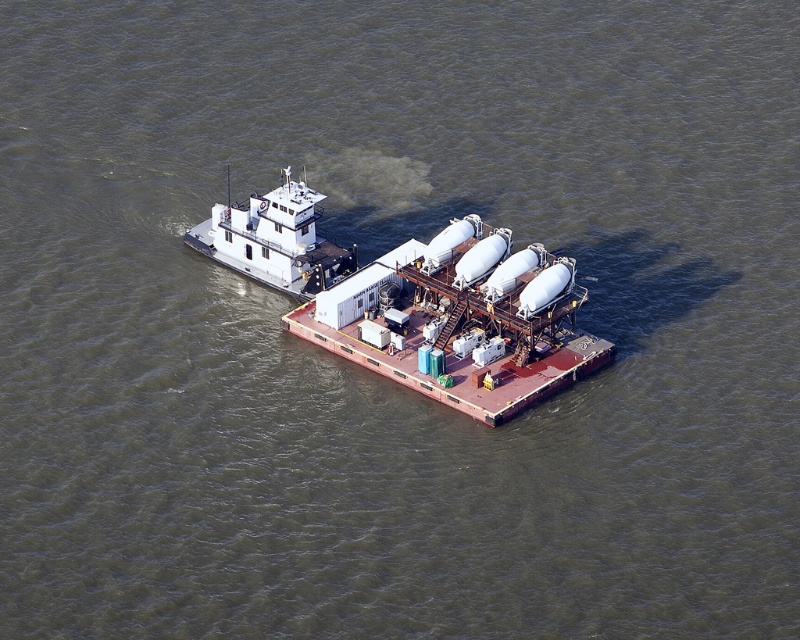
Does white matte tankers at center have a greater width compared to white matte boat at center?

Correct, the width of white matte tankers at center exceeds that of white matte boat at center.

Locate an element on the screen. white matte tankers at center is located at coordinates coord(460,321).